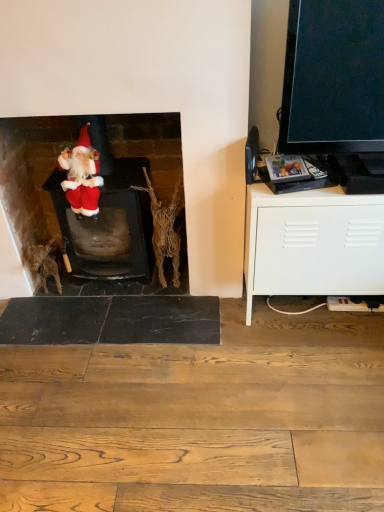
Question: Considering the positions of velvet santa at left and white matte cabinet at right in the image, is velvet santa at left wider or thinner than white matte cabinet at right?

Choices:
 (A) thin
 (B) wide

Answer: (A)

Question: From the image's perspective, is velvet santa at left located above or below white matte cabinet at right?

Choices:
 (A) above
 (B) below

Answer: (A)

Question: Estimate the real-world distances between objects in this image. Which object is farther from the white matte cabinet at right?

Choices:
 (A) velvet santa at left
 (B) fuzzy fabric santa at left

Answer: (B)

Question: Estimate the real-world distances between objects in this image. Which object is farther from the velvet santa at left?

Choices:
 (A) white matte cabinet at right
 (B) fuzzy fabric santa at left

Answer: (A)